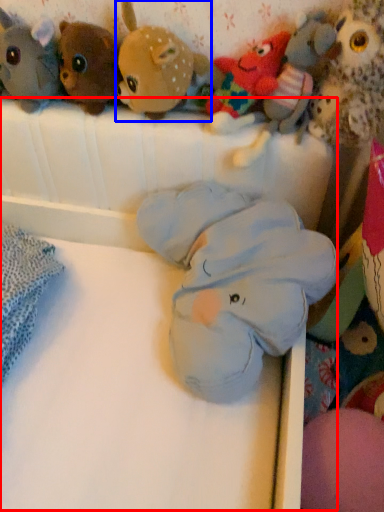
Question: Which object is further to the camera taking this photo, infant bed (highlighted by a red box) or toy (highlighted by a blue box)?

Choices:
 (A) infant bed
 (B) toy

Answer: (B)